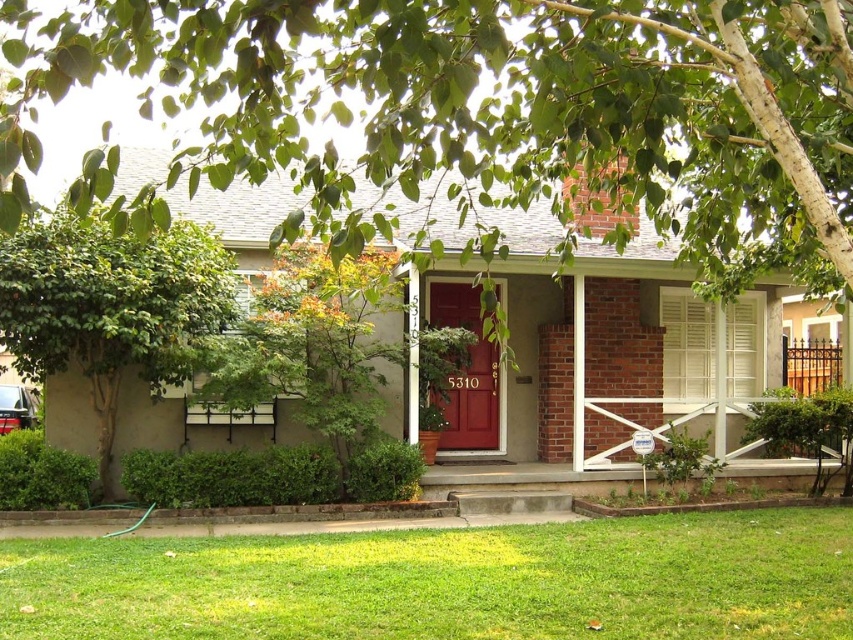
You are standing in front of the house and notice two points marked in the scene. The first point is at coordinate point (53, 288) and the second is at point (445, 288). Which point is closer to you?

The point (53, 288) is closer to you than point (445, 288).

You are standing in the front yard of the house and want to reach the point marked at coordinates point (55,547). If your maximum comfortable walking distance is 8 meters, will you be able to comfortably reach that point?

The distance of point (55,547) from the viewer is 8.25 meters, which exceeds your maximum comfortable walking distance of 8 meters. Therefore, you will not be able to comfortably reach that point.

You are standing in front of the house and want to walk towards the green grass at lower center. Which direction should you walk relative to the green leafy tree at left?

The green grass at lower center is to the right of the green leafy tree at left, so you should walk towards the right side relative to the green leafy tree at left.